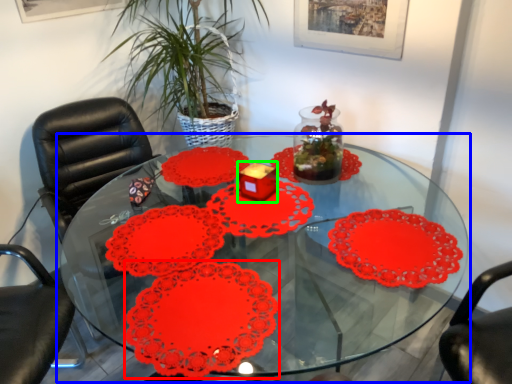
Question: Estimate the real-world distances between objects in this image. Which object is farther from flower (highlighted by a red box), table (highlighted by a blue box) or candle holder (highlighted by a green box)?

Choices:
 (A) table
 (B) candle holder

Answer: (A)